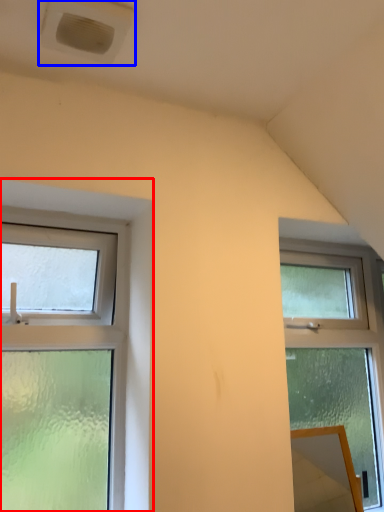
Question: Which object appears closest to the camera in this image, window (highlighted by a red box) or air conditioning (highlighted by a blue box)?

Choices:
 (A) window
 (B) air conditioning

Answer: (B)